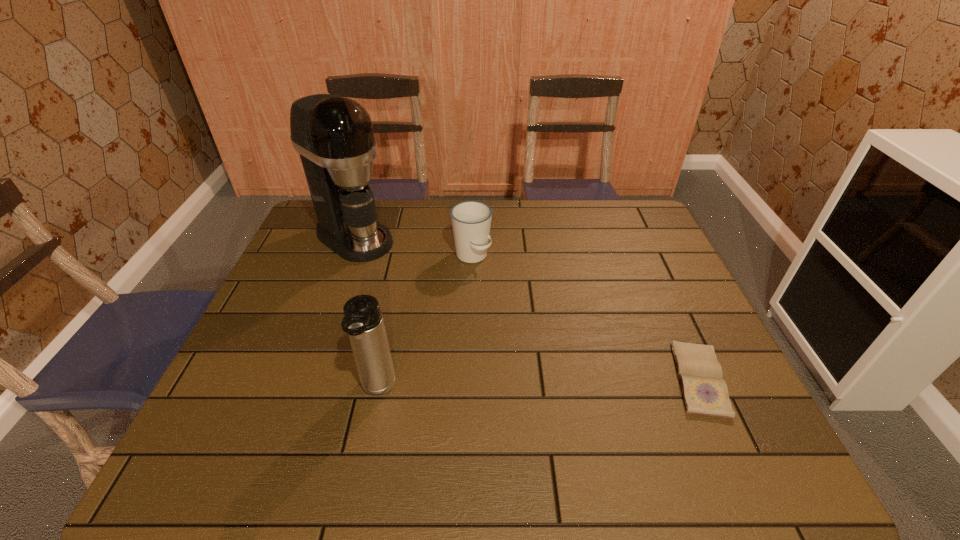
This screenshot has height=540, width=960. I want to click on blank space located with a handle on the side of the cup, so click(x=528, y=324).

Locate an element on the screen. The image size is (960, 540). vacant area situated 0.080m with a handle on the side of the cup is located at coordinates (494, 284).

At what (x,y) coordinates should I click in order to perform the action: click on vacant region located place cup under the spout of the coffee maker. Please return your answer as a coordinate pair (x, y). Looking at the image, I should click on (401, 270).

Identify the location of free region located 0.210m place cup under the spout of the coffee maker. Image resolution: width=960 pixels, height=540 pixels. (422, 285).

Find the location of `vacant space located place cup under the spout of the coffee maker`. vacant space located place cup under the spout of the coffee maker is located at coordinates (429, 290).

The height and width of the screenshot is (540, 960). What are the coordinates of `object located in the far edge section of the desktop` in the screenshot? It's located at point(334,136).

Find the location of a particular element. thermos bottle located at the near edge is located at coordinates (363, 320).

At what (x,y) coordinates should I click in order to perform the action: click on diary located in the near edge section of the desktop. Please return your answer as a coordinate pair (x, y). Looking at the image, I should click on (704, 391).

You are a GUI agent. You are given a task and a screenshot of the screen. Output one action in this format:
    pyautogui.click(x=<x>, y=<y>)
    Task: Click on the object that is at the left edge
    The height and width of the screenshot is (540, 960).
    Given the screenshot: What is the action you would take?
    pyautogui.click(x=334, y=136)

Locate an element on the screen. The width and height of the screenshot is (960, 540). object present at the right edge is located at coordinates (704, 391).